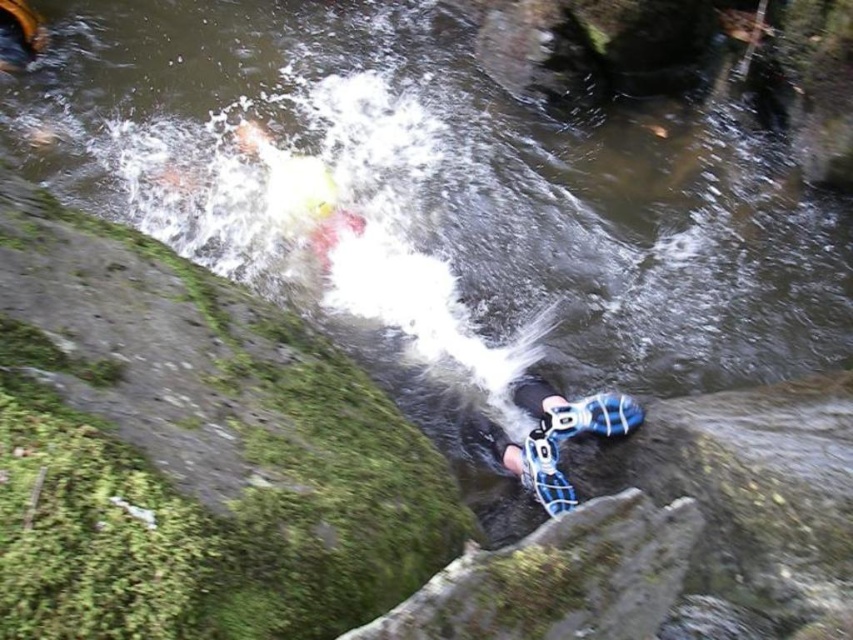
How distant is blue mesh shoes at lower center from blue mesh shoe at lower center?

blue mesh shoes at lower center and blue mesh shoe at lower center are 1.10 inches apart.

Between blue mesh shoes at lower center and blue mesh shoe at lower center, which one appears on the right side from the viewer's perspective?

blue mesh shoe at lower center

Identify the location of blue mesh shoes at lower center. (552, 435).

This screenshot has height=640, width=853. Find the location of `blue mesh shoes at lower center`. blue mesh shoes at lower center is located at coordinates click(x=552, y=435).